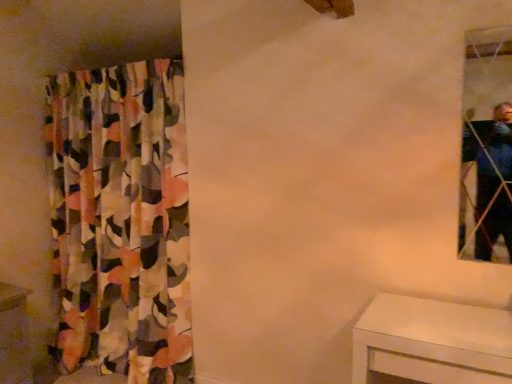
What is the approximate height of white glossy vanity at lower left?

66.11 centimeters.

At what (x,y) coordinates should I click in order to perform the action: click on clear glass mirror at upper right. Please return your answer as a coordinate pair (x, y). Looking at the image, I should click on (486, 147).

From a real-world perspective, is white glossy vanity at lower left located higher than clear glass mirror at upper right?

No, from a real-world perspective, white glossy vanity at lower left is not on top of clear glass mirror at upper right.

From the image's perspective, is white glossy vanity at lower left located above or below clear glass mirror at upper right?

Based on their image positions, white glossy vanity at lower left is located beneath clear glass mirror at upper right.

Can you tell me how much white glossy vanity at lower left and clear glass mirror at upper right differ in facing direction?

The facing directions of white glossy vanity at lower left and clear glass mirror at upper right are 89.9 degrees apart.

Considering the positions of point (9, 303) and point (477, 130), is point (9, 303) closer or farther from the camera than point (477, 130)?

Clearly, point (9, 303) is closer to the camera than point (477, 130).

Is multicolored fabric curtain at left facing towards white glossy vanity at lower left?

Yes, multicolored fabric curtain at left is oriented towards white glossy vanity at lower left.

From the image's perspective, which one is positioned lower, multicolored fabric curtain at left or white glossy vanity at lower left?

white glossy vanity at lower left is shown below in the image.

From a real-world perspective, who is located higher, multicolored fabric curtain at left or white glossy vanity at lower left?

In real-world perspective, multicolored fabric curtain at left is above.

Does multicolored fabric curtain at left appear on the left side of white glossy vanity at lower left?

No, multicolored fabric curtain at left is not to the left of white glossy vanity at lower left.

Does point (466, 130) come in front of point (92, 144)?

Yes, it is in front of point (92, 144).

Can you confirm if clear glass mirror at upper right is shorter than multicolored fabric curtain at left?

Correct, clear glass mirror at upper right is not as tall as multicolored fabric curtain at left.

Which object is further away from the camera taking this photo, clear glass mirror at upper right or multicolored fabric curtain at left?

multicolored fabric curtain at left is behind.

Which object is positioned more to the left, clear glass mirror at upper right or multicolored fabric curtain at left?

multicolored fabric curtain at left.

Can you confirm if clear glass mirror at upper right is shorter than white glossy vanity at lower left?

Incorrect, the height of clear glass mirror at upper right does not fall short of that of white glossy vanity at lower left.

I want to click on vanity that appears behind the clear glass mirror at upper right, so click(x=14, y=336).

Is there a large distance between clear glass mirror at upper right and white glossy vanity at lower left?

Indeed, clear glass mirror at upper right is not near white glossy vanity at lower left.

Measure the distance between clear glass mirror at upper right and white glossy vanity at lower left.

clear glass mirror at upper right is 2.81 meters away from white glossy vanity at lower left.

Considering the sizes of objects multicolored fabric curtain at left and clear glass mirror at upper right in the image provided, who is thinner, multicolored fabric curtain at left or clear glass mirror at upper right?

Thinner between the two is clear glass mirror at upper right.

Looking at this image, looking at the image, does multicolored fabric curtain at left seem bigger or smaller compared to clear glass mirror at upper right?

Considering their sizes, multicolored fabric curtain at left takes up more space than clear glass mirror at upper right.

What are the coordinates of `curtain located underneath the clear glass mirror at upper right (from a real-world perspective)` in the screenshot? It's located at (121, 221).

Is multicolored fabric curtain at left touching clear glass mirror at upper right?

No, multicolored fabric curtain at left is not with clear glass mirror at upper right.

From a real-world perspective, is white glossy vanity at lower left above or below multicolored fabric curtain at left?

white glossy vanity at lower left is situated lower than multicolored fabric curtain at left in the real world.

From the image's perspective, is white glossy vanity at lower left under multicolored fabric curtain at left?

Indeed, from the image's perspective, white glossy vanity at lower left is shown beneath multicolored fabric curtain at left.

Looking at this image, could you tell me if white glossy vanity at lower left is facing multicolored fabric curtain at left?

No, white glossy vanity at lower left is not facing towards multicolored fabric curtain at left.

Is white glossy vanity at lower left bigger than multicolored fabric curtain at left?

Incorrect, white glossy vanity at lower left is not larger than multicolored fabric curtain at left.

This screenshot has width=512, height=384. Identify the location of vanity below the clear glass mirror at upper right (from a real-world perspective). (14, 336).

Where is `vanity that appears on the left of multicolored fabric curtain at left`? The image size is (512, 384). vanity that appears on the left of multicolored fabric curtain at left is located at coordinates (14, 336).

Based on their spatial positions, is clear glass mirror at upper right or multicolored fabric curtain at left further from white glossy vanity at lower left?

clear glass mirror at upper right is further to white glossy vanity at lower left.

Considering their positions, is multicolored fabric curtain at left positioned further to clear glass mirror at upper right than white glossy vanity at lower left?

Based on the image, white glossy vanity at lower left appears to be further to clear glass mirror at upper right.

From the image, which object appears to be farther from multicolored fabric curtain at left, white glossy vanity at lower left or clear glass mirror at upper right?

Among the two, clear glass mirror at upper right is located further to multicolored fabric curtain at left.

Based on their spatial positions, is white glossy vanity at lower left or multicolored fabric curtain at left further from clear glass mirror at upper right?

Among the two, white glossy vanity at lower left is located further to clear glass mirror at upper right.

Based on their spatial positions, is multicolored fabric curtain at left or clear glass mirror at upper right further from white glossy vanity at lower left?

Among the two, clear glass mirror at upper right is located further to white glossy vanity at lower left.

From the image, which object appears to be nearer to multicolored fabric curtain at left, clear glass mirror at upper right or white glossy vanity at lower left?

white glossy vanity at lower left lies closer to multicolored fabric curtain at left than the other object.

You are a GUI agent. You are given a task and a screenshot of the screen. Output one action in this format:
    pyautogui.click(x=<x>, y=<y>)
    Task: Click on the curtain between white glossy vanity at lower left and clear glass mirror at upper right
    The height and width of the screenshot is (384, 512).
    Given the screenshot: What is the action you would take?
    pyautogui.click(x=121, y=221)